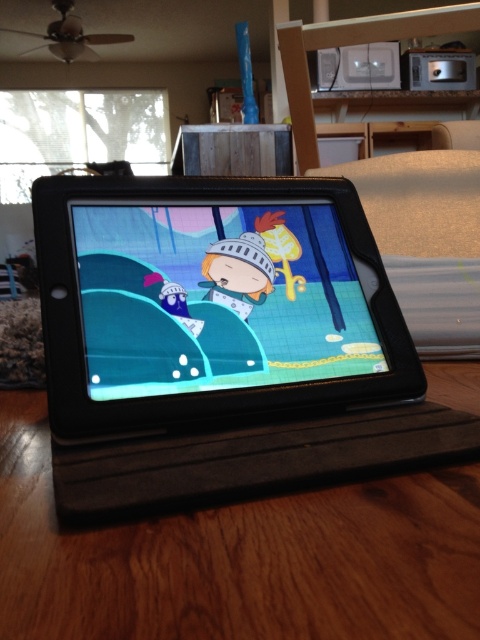
Question: Among these points, which one is farthest from the camera?

Choices:
 (A) (442, 604)
 (B) (156, 374)

Answer: (B)

Question: Which point is closer to the camera?

Choices:
 (A) wooden table at center
 (B) matte black tablet at center

Answer: (A)

Question: Is wooden table at center further to camera compared to matte black tablet at center?

Choices:
 (A) yes
 (B) no

Answer: (B)

Question: Can you confirm if wooden table at center is bigger than matte black tablet at center?

Choices:
 (A) yes
 (B) no

Answer: (A)

Question: Does wooden table at center appear under matte black tablet at center?

Choices:
 (A) no
 (B) yes

Answer: (B)